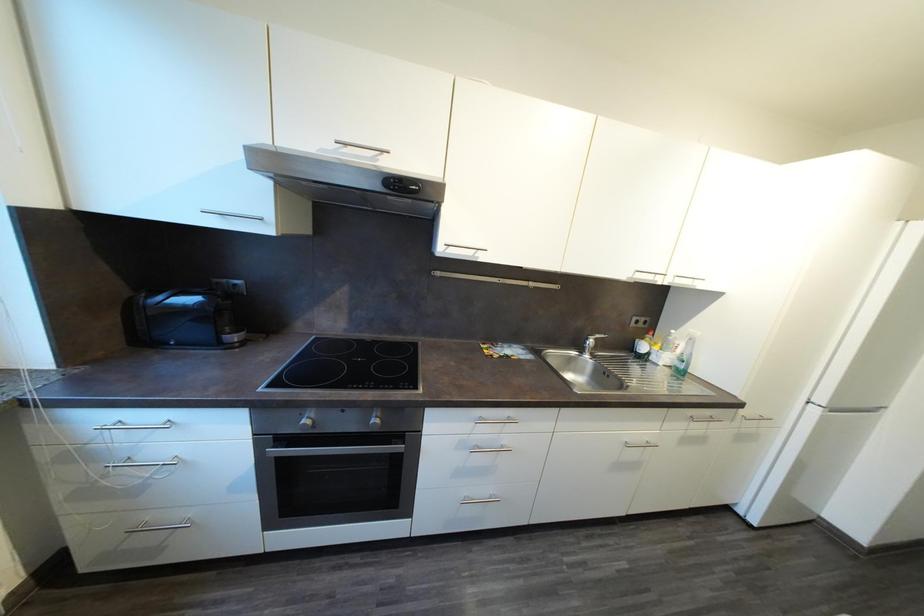
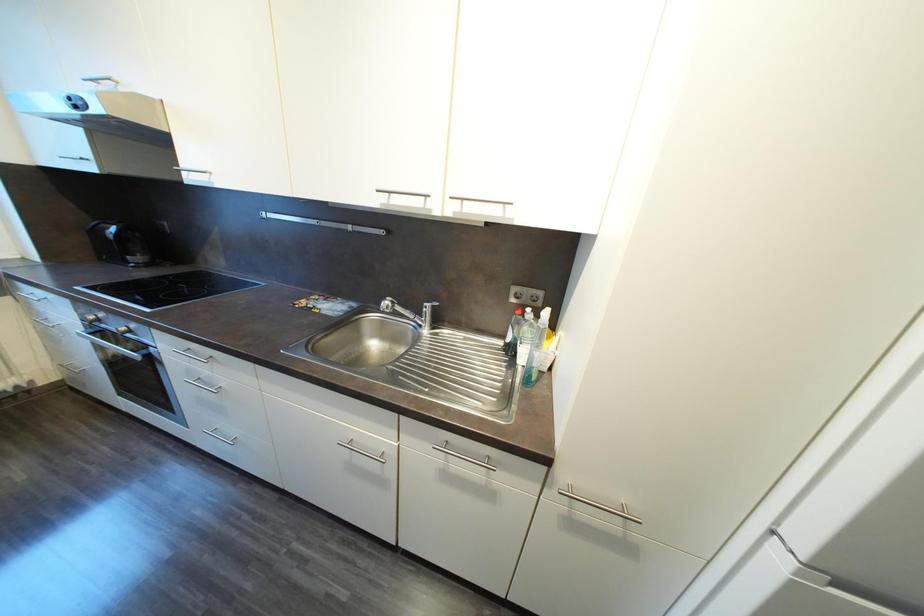
Which direction would the cameraman need to move to produce the second image?

The movement direction of the cameraman is right, forward.